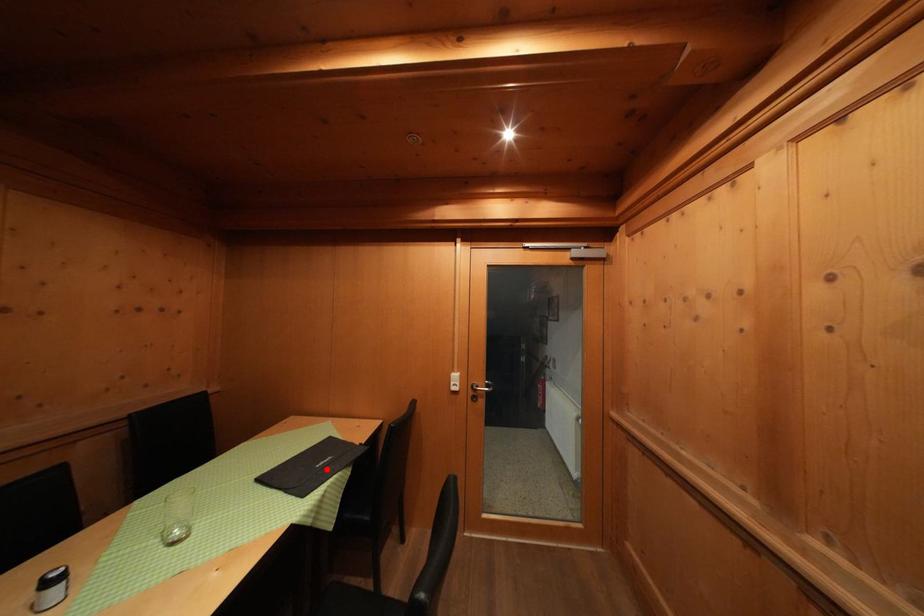
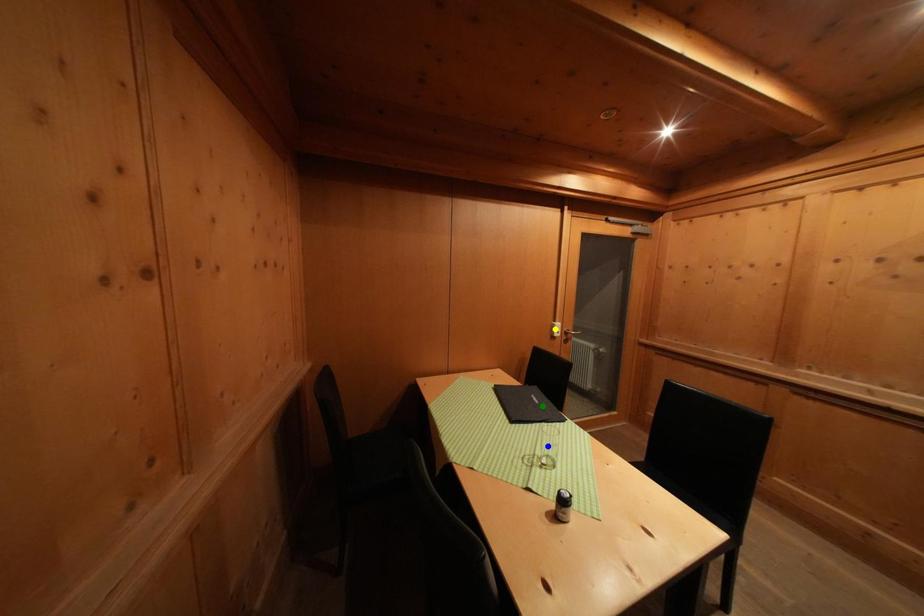
Question: I am providing you with two images of the same scene from different viewpoints. A red point is marked on the first image. You are given multiple points on the second image. Which mark in image 2 goes with the point in image 1?

Choices:
 (A) blue point
 (B) yellow point
 (C) green point

Answer: (C)